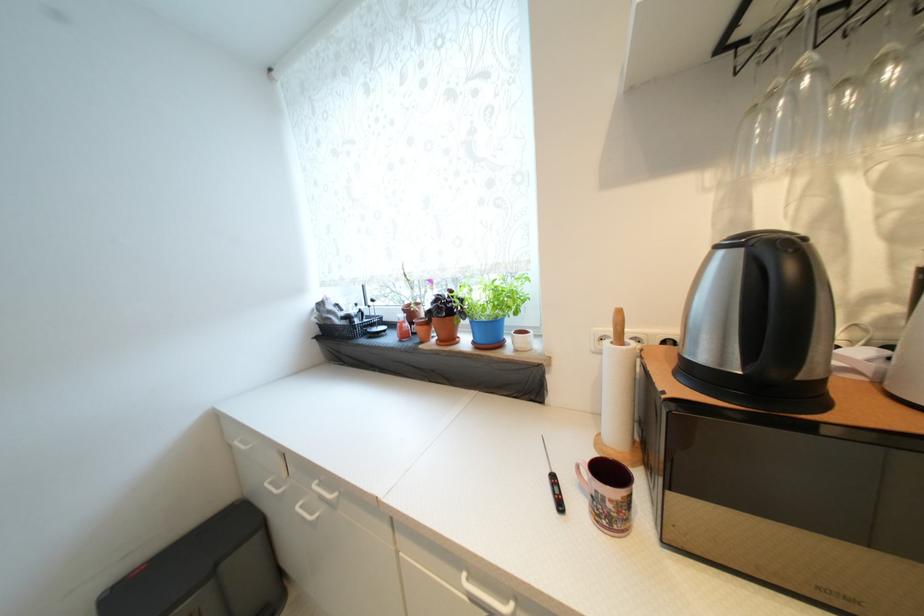
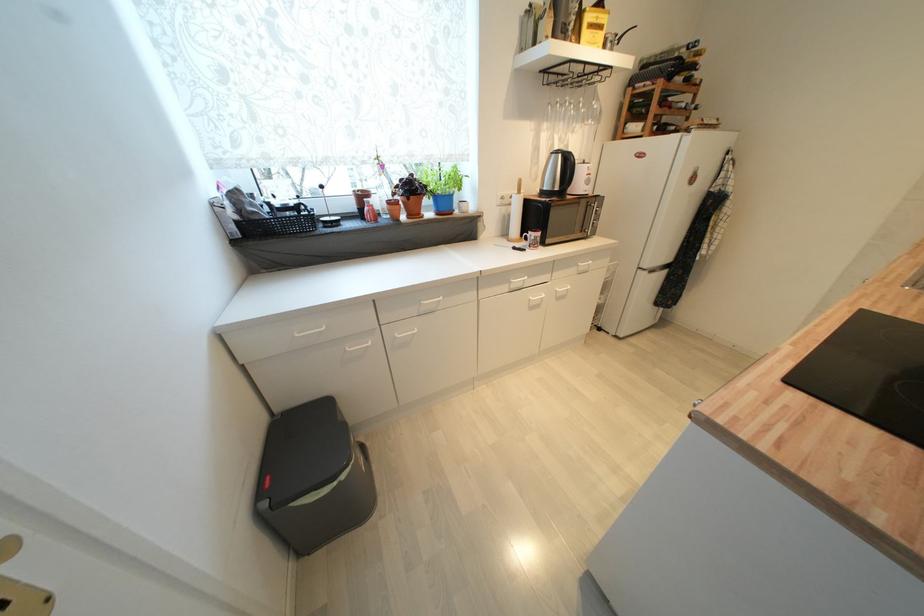
Locate, in the second image, the point that corresponds to the point at 324,326 in the first image.

(242, 225)